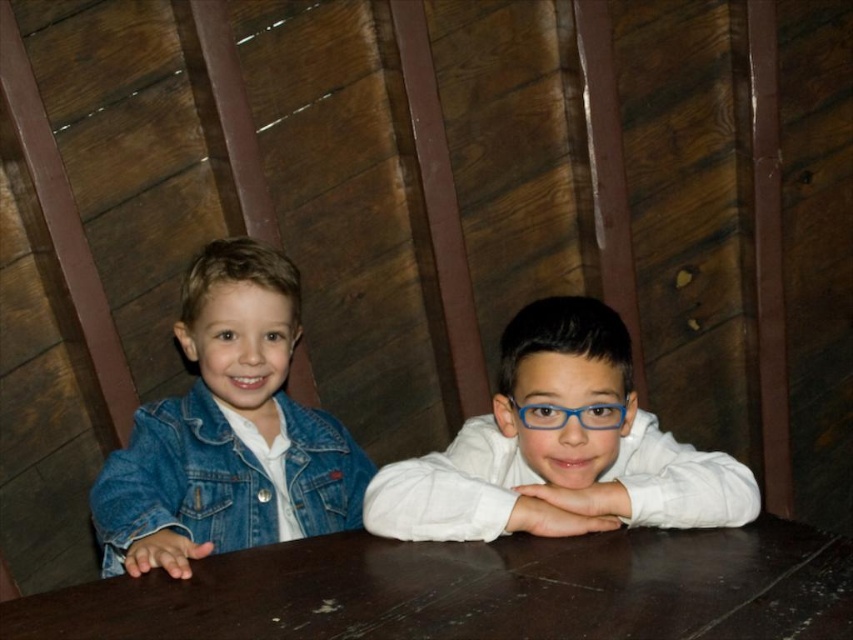
In the scene shown: Who is higher up, white glossy shirt at center or blue plastic glasses at center?

blue plastic glasses at center

Is point (445, 493) farther from viewer compared to point (593, 428)?

Yes, point (445, 493) is farther from viewer.

Between point (631, 497) and point (525, 426), which one is positioned behind?

Point (525, 426)

Locate an element on the screen. white glossy shirt at center is located at coordinates (560, 449).

Can you confirm if brown wooden table at center is positioned to the left of brushed denim jacket at lower left?

In fact, brown wooden table at center is to the right of brushed denim jacket at lower left.

Describe the element at coordinates (477, 589) in the screenshot. The width and height of the screenshot is (853, 640). I see `brown wooden table at center` at that location.

Where is `brown wooden table at center`? brown wooden table at center is located at coordinates (x=477, y=589).

Is point (108, 508) positioned in front of point (553, 429)?

That is False.

Looking at this image, does brushed denim jacket at lower left have a larger size compared to blue plastic glasses at center?

Indeed, brushed denim jacket at lower left has a larger size compared to blue plastic glasses at center.

What do you see at coordinates (224, 477) in the screenshot?
I see `brushed denim jacket at lower left` at bounding box center [224, 477].

You are a GUI agent. You are given a task and a screenshot of the screen. Output one action in this format:
    pyautogui.click(x=<x>, y=<y>)
    Task: Click on the brushed denim jacket at lower left
    This screenshot has width=853, height=640.
    Given the screenshot: What is the action you would take?
    pyautogui.click(x=224, y=477)